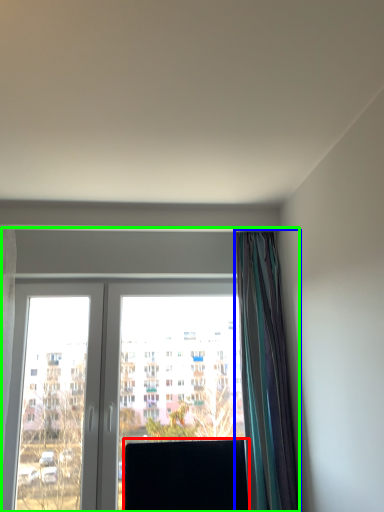
Question: Which is farther away from window screen (highlighted by a red box)? curtain (highlighted by a blue box) or window (highlighted by a green box)?

Choices:
 (A) curtain
 (B) window

Answer: (A)